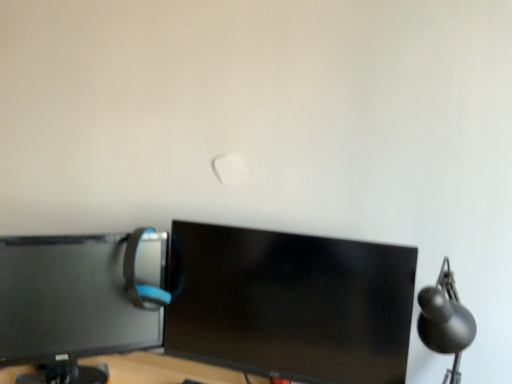
Question: Does matte gray computer chair at left have a lesser height compared to black glossy monitor at center, the first computer monitor when ordered from right to left?

Choices:
 (A) no
 (B) yes

Answer: (B)

Question: Does matte gray computer chair at left contain black glossy monitor at center, arranged as the second computer monitor when viewed from the left?

Choices:
 (A) yes
 (B) no

Answer: (B)

Question: Can you confirm if matte gray computer chair at left is thinner than black glossy monitor at center, the first computer monitor when ordered from right to left?

Choices:
 (A) yes
 (B) no

Answer: (B)

Question: From the image's perspective, is matte gray computer chair at left above black glossy monitor at center, the first computer monitor when ordered from right to left?

Choices:
 (A) no
 (B) yes

Answer: (B)

Question: Considering the relative sizes of matte gray computer chair at left and black glossy monitor at center, arranged as the second computer monitor when viewed from the left, in the image provided, is matte gray computer chair at left taller than black glossy monitor at center, arranged as the second computer monitor when viewed from the left,?

Choices:
 (A) no
 (B) yes

Answer: (A)

Question: From the image's perspective, would you say matte gray computer chair at left is shown under black glossy monitor at center, arranged as the second computer monitor when viewed from the left?

Choices:
 (A) yes
 (B) no

Answer: (B)

Question: Is matte gray computer chair at left further to the viewer compared to matte black monitor at left, marked as the 2th computer monitor in a right-to-left arrangement?

Choices:
 (A) yes
 (B) no

Answer: (A)

Question: Can you confirm if matte gray computer chair at left is positioned to the left of matte black monitor at left, marked as the 2th computer monitor in a right-to-left arrangement?

Choices:
 (A) no
 (B) yes

Answer: (A)

Question: Does matte gray computer chair at left come in front of matte black monitor at left, marked as the 2th computer monitor in a right-to-left arrangement?

Choices:
 (A) yes
 (B) no

Answer: (B)

Question: Can you confirm if matte gray computer chair at left is wider than matte black monitor at left, the first computer monitor positioned from the left?

Choices:
 (A) yes
 (B) no

Answer: (B)

Question: Can matte black monitor at left, marked as the 2th computer monitor in a right-to-left arrangement, be found inside matte gray computer chair at left?

Choices:
 (A) yes
 (B) no

Answer: (B)

Question: From the image's perspective, is matte gray computer chair at left on matte black monitor at left, marked as the 2th computer monitor in a right-to-left arrangement?

Choices:
 (A) yes
 (B) no

Answer: (A)

Question: From a real-world perspective, does matte black monitor at left, marked as the 2th computer monitor in a right-to-left arrangement, sit lower than black matte table lamp at right?

Choices:
 (A) yes
 (B) no

Answer: (A)